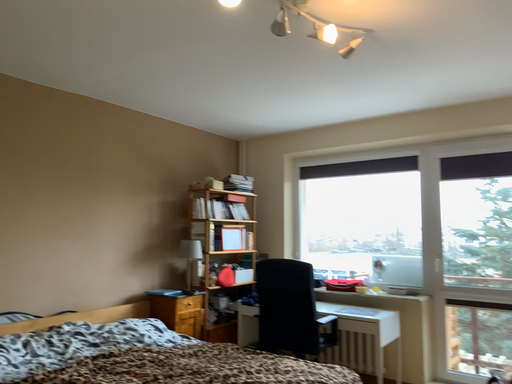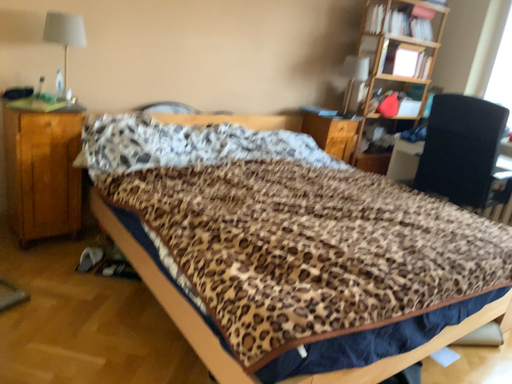
Question: Which way did the camera rotate in the video?

Choices:
 (A) rotated upward
 (B) rotated downward

Answer: (B)